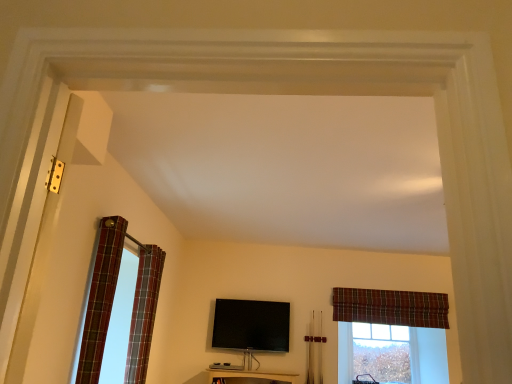
Question: Is plaid fabric curtain at upper right, the first curtain positioned from the back, at the right side of plaid fabric curtain at left, arranged as the 3th curtain when viewed from the back?

Choices:
 (A) no
 (B) yes

Answer: (B)

Question: From a real-world perspective, is plaid fabric curtain at upper right, which is the 3th curtain from left to right, on top of plaid fabric curtain at left, arranged as the 3th curtain when viewed from the back?

Choices:
 (A) yes
 (B) no

Answer: (A)

Question: Is plaid fabric curtain at upper right, which is the 3th curtain from left to right, closer to camera compared to plaid fabric curtain at left, arranged as the 3th curtain when viewed from the back?

Choices:
 (A) no
 (B) yes

Answer: (A)

Question: Does plaid fabric curtain at upper right, which is the 3th curtain from left to right, have a lesser width compared to plaid fabric curtain at left, acting as the 1th curtain starting from the left?

Choices:
 (A) no
 (B) yes

Answer: (B)

Question: Does plaid fabric curtain at upper right, the first curtain positioned from the back, turn towards plaid fabric curtain at left, the 3th curtain from the right?

Choices:
 (A) no
 (B) yes

Answer: (A)

Question: From a real-world perspective, is clear glass window at center positioned above or below plaid fabric curtain at left, arranged as the 3th curtain when viewed from the back?

Choices:
 (A) above
 (B) below

Answer: (B)

Question: Is clear glass window at center taller or shorter than plaid fabric curtain at left, which is the 1th curtain in front-to-back order?

Choices:
 (A) tall
 (B) short

Answer: (B)

Question: Considering the positions of clear glass window at center and plaid fabric curtain at left, acting as the 1th curtain starting from the left, in the image, is clear glass window at center bigger or smaller than plaid fabric curtain at left, acting as the 1th curtain starting from the left,?

Choices:
 (A) big
 (B) small

Answer: (A)

Question: Is clear glass window at center to the left or to the right of plaid fabric curtain at left, the 3th curtain from the right, in the image?

Choices:
 (A) left
 (B) right

Answer: (B)

Question: Is point (373, 349) closer or farther from the camera than point (250, 329)?

Choices:
 (A) closer
 (B) farther

Answer: (B)

Question: From the image's perspective, relative to black glossy flat-screen tv at center, is clear glass window at center above or below?

Choices:
 (A) above
 (B) below

Answer: (B)

Question: In terms of size, does clear glass window at center appear bigger or smaller than black glossy flat-screen tv at center?

Choices:
 (A) big
 (B) small

Answer: (A)

Question: Is clear glass window at center situated inside black glossy flat-screen tv at center or outside?

Choices:
 (A) outside
 (B) inside

Answer: (A)

Question: From the image's perspective, is plaid fabric curtain at upper right, which is the 3th curtain in front-to-back order, positioned above or below black glossy flat-screen tv at center?

Choices:
 (A) below
 (B) above

Answer: (B)

Question: Considering the positions of point (374, 294) and point (282, 304), is point (374, 294) closer or farther from the camera than point (282, 304)?

Choices:
 (A) closer
 (B) farther

Answer: (B)